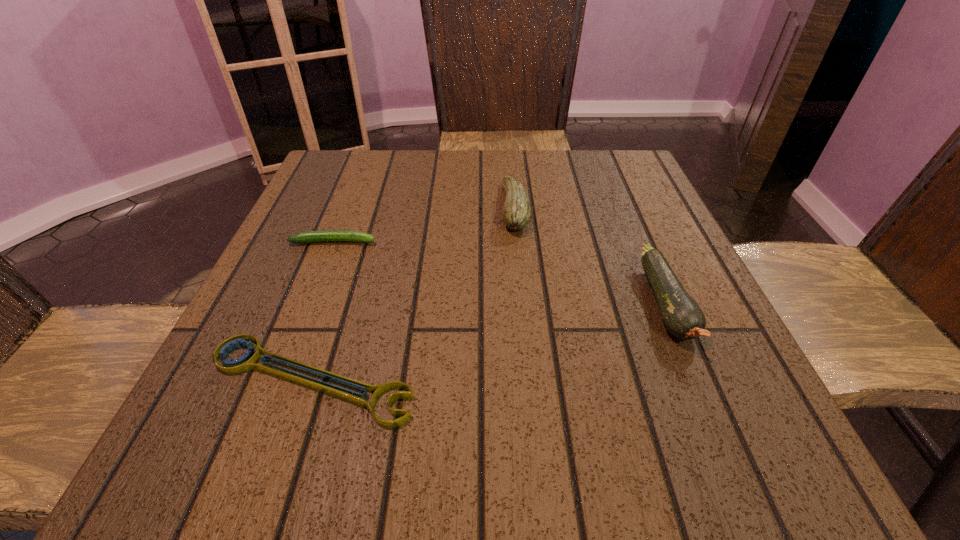
Identify the location of vacant space in between the farthest object and the wrench. This screenshot has height=540, width=960. (413, 294).

This screenshot has height=540, width=960. In order to click on vacant point located between the wrench and the farthest zucchini in this screenshot , I will do `click(413, 294)`.

Locate an element on the screen. empty location between the rightmost object and the wrench is located at coordinates (489, 342).

The width and height of the screenshot is (960, 540). What are the coordinates of `free space that is in between the second object from right to left and the rightmost object` in the screenshot? It's located at (590, 256).

The height and width of the screenshot is (540, 960). I want to click on empty location between the third object from left to right and the nearest zucchini, so click(590, 256).

The height and width of the screenshot is (540, 960). What are the coordinates of `object that stands as the second closest to the wrench` in the screenshot? It's located at (516, 214).

Select which object is the third closest to the shortest zucchini. Please provide its 2D coordinates. Your answer should be formatted as a tuple, i.e. [(x, y)], where the tuple contains the x and y coordinates of a point satisfying the conditions above.

[(682, 316)]

I want to click on zucchini that stands as the closest to the rightmost object, so click(x=516, y=214).

Identify which zucchini is the nearest to the farthest zucchini. Please provide its 2D coordinates. Your answer should be formatted as a tuple, i.e. [(x, y)], where the tuple contains the x and y coordinates of a point satisfying the conditions above.

[(682, 316)]

Locate an element on the screen. Image resolution: width=960 pixels, height=540 pixels. vacant area in the image that satisfies the following two spatial constraints: 1. on the front-facing side of the shortest object; 2. on the left side of the second farthest zucchini is located at coordinates [279, 380].